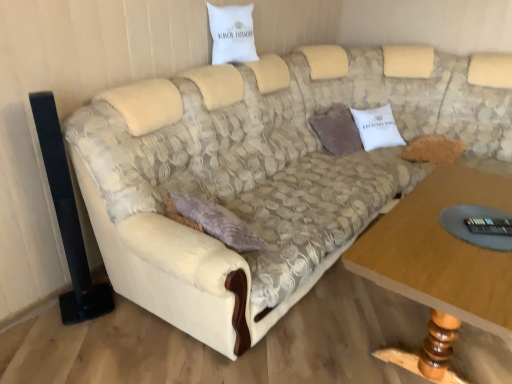
The width and height of the screenshot is (512, 384). What are the coordinates of `free location above transparent glass remote control at lower right (from a real-world perspective)` in the screenshot? It's located at (479, 223).